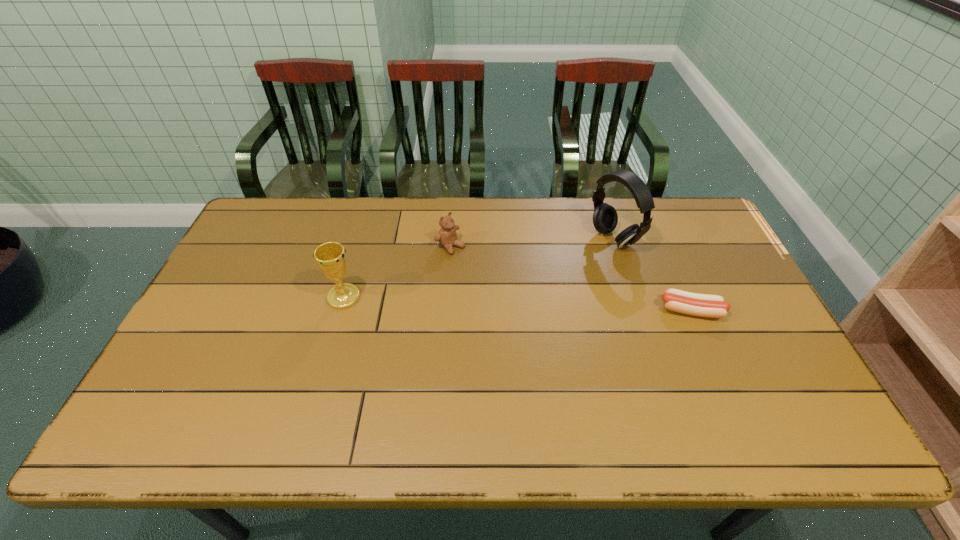
This screenshot has width=960, height=540. Identify the location of free space on the desktop that is between the third shortest object and the sausage and is positioned on the ear cups of the earphone. (480, 302).

This screenshot has width=960, height=540. In order to click on free spot on the desktop that is between the chalice and the sausage and is positioned on the face of the teddy bear in this screenshot , I will do `click(523, 304)`.